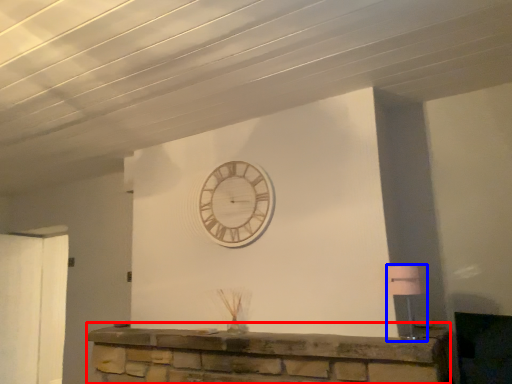
Question: Among these objects, which one is farthest to the camera, furniture (highlighted by a red box) or lamp (highlighted by a blue box)?

Choices:
 (A) furniture
 (B) lamp

Answer: (B)